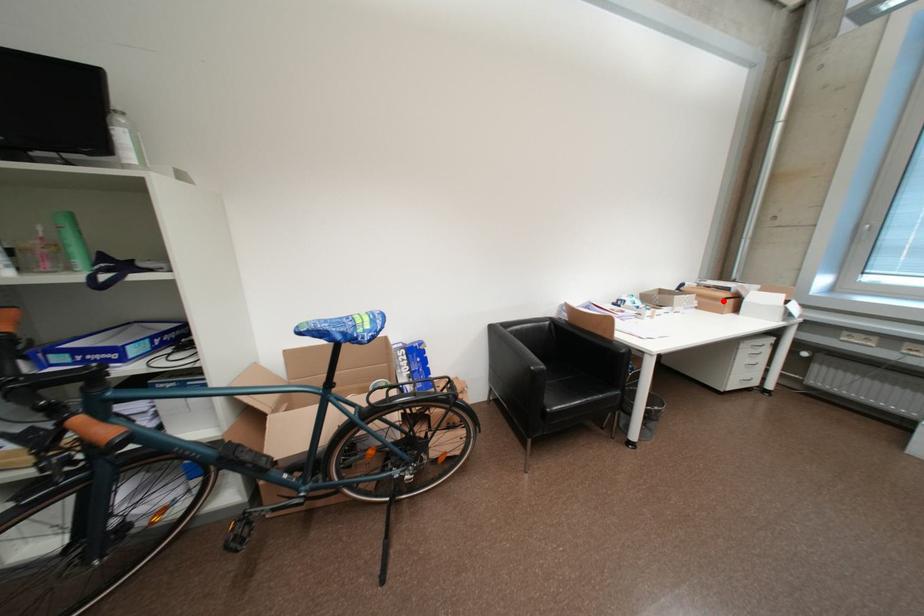
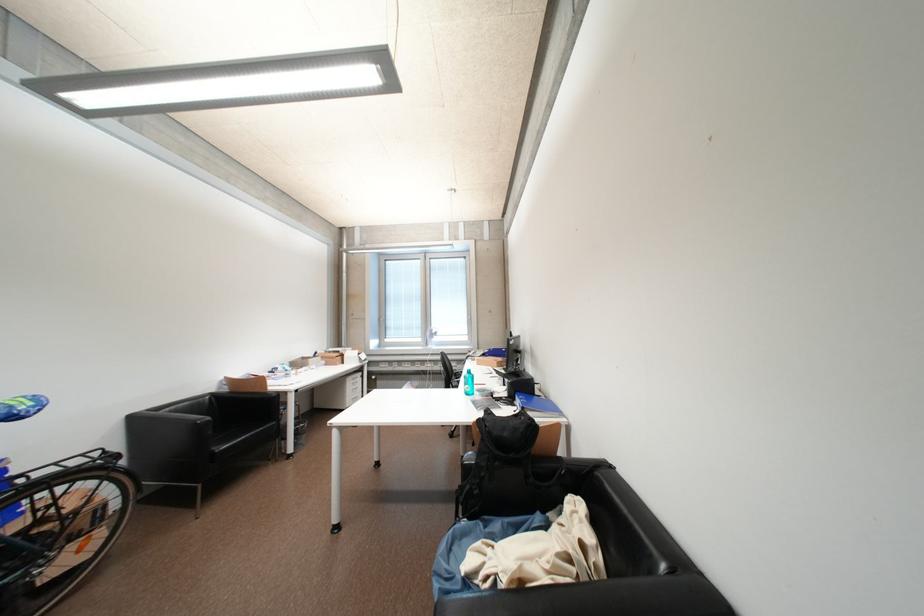
Locate, in the second image, the point that corresponds to the highlighted location in the first image.

(341, 360)